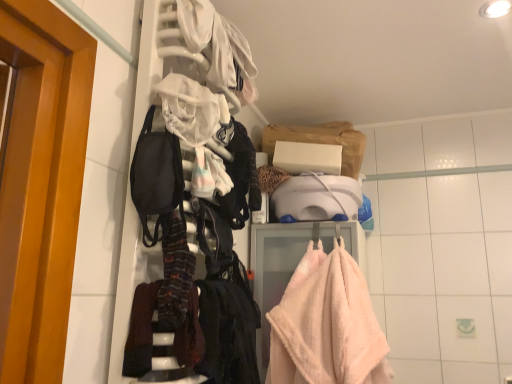
Looking at this image, in order to face black fabric mask at left, should I rotate leftwards or rightwards?

Turn left approximately 12.304 degrees to face it.

Measure the distance between point (332,312) and camera.

Point (332,312) is 1.29 meters away from camera.

You are a GUI agent. You are given a task and a screenshot of the screen. Output one action in this format:
    pyautogui.click(x=<x>, y=<y>)
    Task: Click on the black fabric at center
    
    Given the screenshot: What is the action you would take?
    pyautogui.click(x=228, y=332)

Who is taller, soft pink plush towel at center or black fabric at center?

Standing taller between the two is soft pink plush towel at center.

Image resolution: width=512 pixels, height=384 pixels. I want to click on towel on the right of black fabric at center, so click(x=327, y=324).

What's the angular difference between soft pink plush towel at center and black fabric at center's facing directions?

They differ by 92.5 degrees in their facing directions.

From a real-world perspective, relative to black fabric at center, is soft pink plush towel at center vertically above or below?

soft pink plush towel at center is situated higher than black fabric at center in the real world.

Is black fabric at center positioned with its back to soft pink plush towel at center?

No, black fabric at center is not facing the opposite direction of soft pink plush towel at center.

From a real-world perspective, between black fabric at center and soft pink plush towel at center, who is vertically higher?

soft pink plush towel at center, from a real-world perspective.

Considering the relative sizes of black fabric at center and soft pink plush towel at center in the image provided, is black fabric at center bigger than soft pink plush towel at center?

Actually, black fabric at center might be smaller than soft pink plush towel at center.

From the image's perspective, is black fabric at center below soft pink plush towel at center?

No, from the image's perspective, black fabric at center is not beneath soft pink plush towel at center.

Which of these two, black fabric mask at left or soft pink plush towel at center, is thinner?

black fabric mask at left.

In the scene shown: Is black fabric mask at left positioned far away from soft pink plush towel at center?

No, black fabric mask at left is in close proximity to soft pink plush towel at center.

From the image's perspective, is black fabric mask at left positioned above or below soft pink plush towel at center?

Based on their image positions, black fabric mask at left is located above soft pink plush towel at center.

Could you tell me if black fabric mask at left is facing soft pink plush towel at center?

No, black fabric mask at left is not aimed at soft pink plush towel at center.

Relative to black fabric at center, is black fabric mask at left in front or behind?

Clearly, black fabric mask at left is in front of black fabric at center.

Can you tell me how much black fabric mask at left and black fabric at center differ in facing direction?

They differ by 0.000186 degrees in their facing directions.

From a real-world perspective, is black fabric mask at left physically located above or below black fabric at center?

In terms of real-world spatial position, black fabric mask at left is above black fabric at center.

You are a GUI agent. You are given a task and a screenshot of the screen. Output one action in this format:
    pyautogui.click(x=<x>, y=<y>)
    Task: Click on the clothing below the black fabric mask at left (from the image's perspective)
    The image size is (512, 384).
    Given the screenshot: What is the action you would take?
    pyautogui.click(x=228, y=332)

Does black fabric at center have a lesser height compared to black fabric mask at left?

In fact, black fabric at center may be taller than black fabric mask at left.

Does black fabric at center have a lesser width compared to black fabric mask at left?

Yes, black fabric at center is thinner than black fabric mask at left.

Based on their sizes in the image, would you say black fabric at center is bigger or smaller than black fabric mask at left?

black fabric at center is bigger than black fabric mask at left.

Is black fabric at center with black fabric mask at left?

No, black fabric at center is not touching black fabric mask at left.

From a real-world perspective, which object stands above the other?

black fabric mask at left, from a real-world perspective.

Does soft pink plush towel at center have a lesser width compared to black fabric mask at left?

No.

Is the surface of soft pink plush towel at center in direct contact with black fabric mask at left?

No, soft pink plush towel at center is not touching black fabric mask at left.

At what (x,y) coordinates should I click in order to perform the action: click on clothing that is in front of the soft pink plush towel at center. Please return your answer as a coordinate pair (x, y). Image resolution: width=512 pixels, height=384 pixels. Looking at the image, I should click on pyautogui.click(x=228, y=332).

Identify the location of clothing below the soft pink plush towel at center (from a real-world perspective). (228, 332).

Looking at the image, which one is located closer to black fabric at center, black fabric mask at left or soft pink plush towel at center?

black fabric mask at left.

Looking at the image, which one is located further to soft pink plush towel at center, black fabric mask at left or black fabric at center?

black fabric mask at left.

When comparing their distances from black fabric mask at left, does soft pink plush towel at center or black fabric at center seem further?

soft pink plush towel at center is positioned further to the anchor black fabric mask at left.

Which object lies nearer to the anchor point black fabric mask at left, black fabric at center or soft pink plush towel at center?

black fabric at center is positioned closer to the anchor black fabric mask at left.

Based on the photo, when comparing their distances from black fabric at center, does soft pink plush towel at center or black fabric mask at left seem closer?

Based on the image, black fabric mask at left appears to be nearer to black fabric at center.

Considering their positions, is black fabric at center positioned further to soft pink plush towel at center than black fabric mask at left?

Based on the image, black fabric mask at left appears to be further to soft pink plush towel at center.

Locate an element on the screen. Image resolution: width=512 pixels, height=384 pixels. clothing between black fabric mask at left and soft pink plush towel at center from left to right is located at coordinates (228, 332).